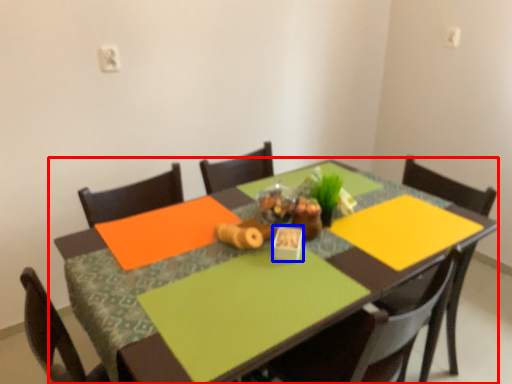
Question: Among these objects, which one is nearest to the camera, table (highlighted by a red box) or tableware (highlighted by a blue box)?

Choices:
 (A) table
 (B) tableware

Answer: (A)